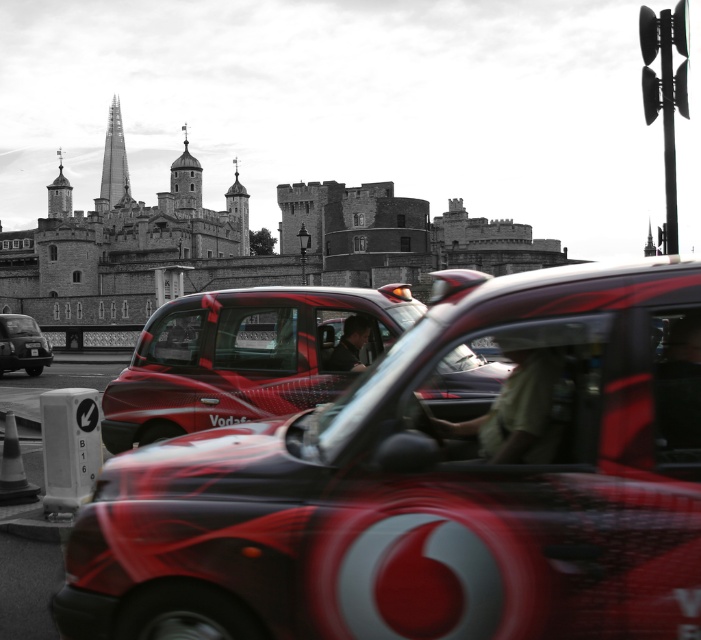
You are standing in the bustling urban scene with red taxis and historic buildings. You see two points marked in the image. Which point is closer to you, point (409, 547) or point (15, 346)?

Point (409, 547) is closer to the viewer than point (15, 346).

You are a tourist in London and want to take a photo of the Tower of London and the Shard skyscraper in the background. You have a camera with a 50mm lens. The metallic red taxi at center is blocking your view. Based on its coordinates, can you estimate whether the taxi is positioned in front of the Tower of London or the Shard?

The metallic red taxi at center is positioned at coordinates point [433,484]. Since the Tower of London is to the left of the Shard in the background, and the taxi is at the center, it is likely blocking the view of the Tower of London.

You are a delivery driver needing to park your vehicle in a narrow alley that can only accommodate vehicles up to the width of the metallic silver car at left. Given that you are driving the metallic red taxi at center, will your vehicle fit in the alley?

The metallic red taxi at center is wider than the metallic silver car at left, so it will not fit in the alley designed for the narrower vehicle.